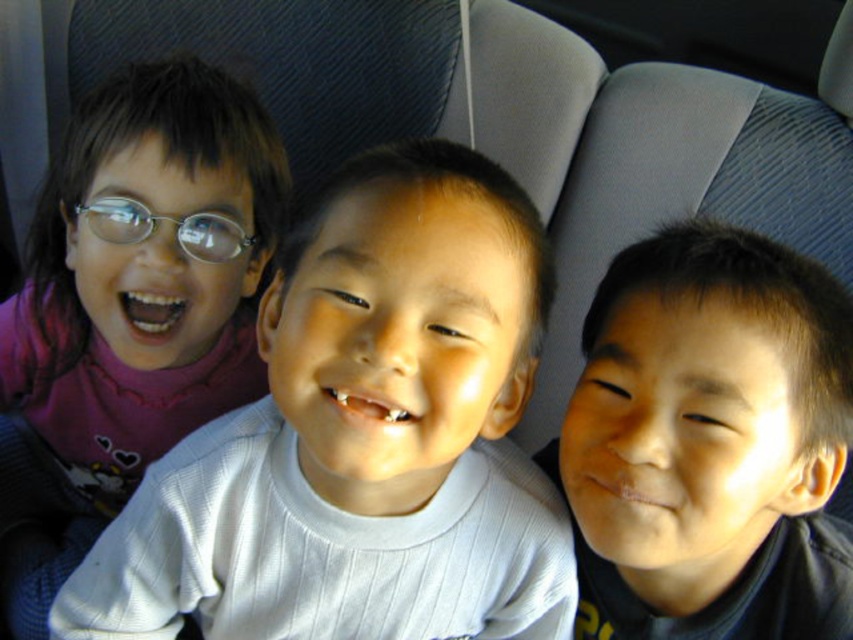
Question: Among these objects, which one is farthest from the camera?

Choices:
 (A) purple fleece shirt at left
 (B) metallic silver glasses at left
 (C) smooth skin face at center

Answer: (A)

Question: Can you confirm if pink fabric shirt at left is wider than purple fleece shirt at left?

Choices:
 (A) yes
 (B) no

Answer: (A)

Question: Can you confirm if purple fleece shirt at left is thinner than metallic silver glasses at left?

Choices:
 (A) yes
 (B) no

Answer: (B)

Question: Is pink fabric shirt at left positioned in front of metallic silver glasses at left?

Choices:
 (A) yes
 (B) no

Answer: (A)

Question: Which object is closer to the camera taking this photo?

Choices:
 (A) purple fleece shirt at left
 (B) metallic silver glasses at left
 (C) pink fabric shirt at left
 (D) smooth skin face at center

Answer: (C)

Question: Which object appears farthest from the camera in this image?

Choices:
 (A) metallic silver glasses at left
 (B) pink fabric shirt at left
 (C) purple fleece shirt at left
 (D) smooth skin face at center

Answer: (C)